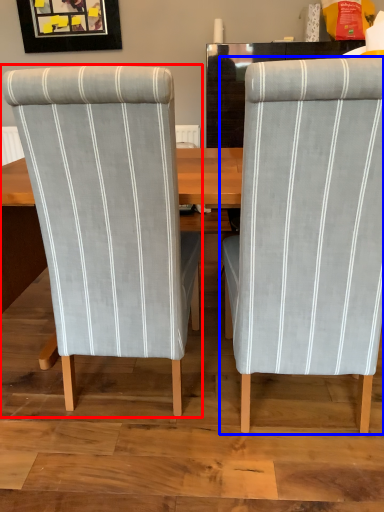
Question: Which object appears farthest to the camera in this image, chair (highlighted by a red box) or chair (highlighted by a blue box)?

Choices:
 (A) chair
 (B) chair

Answer: (A)